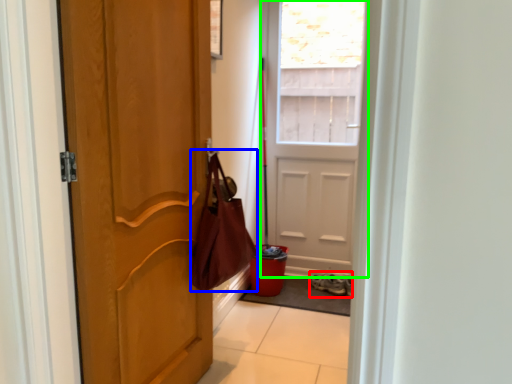
Question: Considering the real-world distances, which object is closest to footwear (highlighted by a red box)? shoulder bag (highlighted by a blue box) or door (highlighted by a green box).

Choices:
 (A) shoulder bag
 (B) door

Answer: (B)